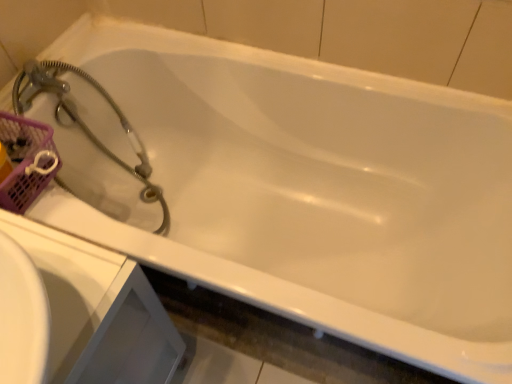
Question: Is pink mesh basket at upper left looking in the opposite direction of white glossy sink at lower left?

Choices:
 (A) yes
 (B) no

Answer: (B)

Question: Is pink mesh basket at upper left further to the viewer compared to white glossy sink at lower left?

Choices:
 (A) no
 (B) yes

Answer: (B)

Question: Is pink mesh basket at upper left not inside white glossy sink at lower left?

Choices:
 (A) yes
 (B) no

Answer: (A)

Question: Is white glossy sink at lower left surrounded by pink mesh basket at upper left?

Choices:
 (A) yes
 (B) no

Answer: (B)

Question: Can you confirm if pink mesh basket at upper left is bigger than white glossy sink at lower left?

Choices:
 (A) no
 (B) yes

Answer: (A)

Question: Are pink mesh basket at upper left and white glossy sink at lower left located far from each other?

Choices:
 (A) yes
 (B) no

Answer: (B)

Question: Is white glossy sink at lower left positioned before satin silver hose at upper left?

Choices:
 (A) yes
 (B) no

Answer: (A)

Question: From a real-world perspective, is white glossy sink at lower left positioned over satin silver hose at upper left based on gravity?

Choices:
 (A) yes
 (B) no

Answer: (B)

Question: Considering the relative sizes of white glossy sink at lower left and satin silver hose at upper left in the image provided, is white glossy sink at lower left thinner than satin silver hose at upper left?

Choices:
 (A) yes
 (B) no

Answer: (A)

Question: Can you confirm if white glossy sink at lower left is wider than satin silver hose at upper left?

Choices:
 (A) yes
 (B) no

Answer: (B)

Question: From the image's perspective, is white glossy sink at lower left on top of satin silver hose at upper left?

Choices:
 (A) yes
 (B) no

Answer: (B)

Question: From the image's perspective, is white glossy sink at lower left beneath satin silver hose at upper left?

Choices:
 (A) yes
 (B) no

Answer: (A)

Question: Is satin silver hose at upper left to the left of pink mesh basket at upper left from the viewer's perspective?

Choices:
 (A) no
 (B) yes

Answer: (A)